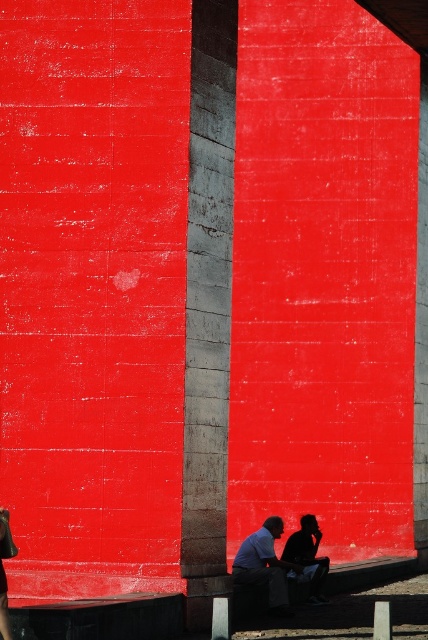
You are an interior designer planning to place a large sculpture between the concrete pillar at center and the silhouette fabric at lower right. Considering their sizes, which object should the sculpture be placed closer to for balance?

The sculpture should be placed closer to the concrete pillar at center because it has a larger size compared to the silhouette fabric at lower right, creating a balanced composition.

You are an interior designer assessing the layout of a room with a concrete pillar at center and a matte blue shirt at lower center. Which object is positioned higher in the scene?

Result: The concrete pillar at center is positioned higher than the matte blue shirt at lower center.